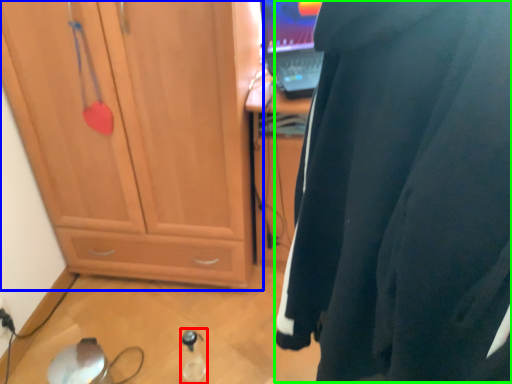
Question: Which object is the closest to the bottle (highlighted by a red box)? Choose among these: cabinetry (highlighted by a blue box) or wetsuit (highlighted by a green box).

Choices:
 (A) cabinetry
 (B) wetsuit

Answer: (A)